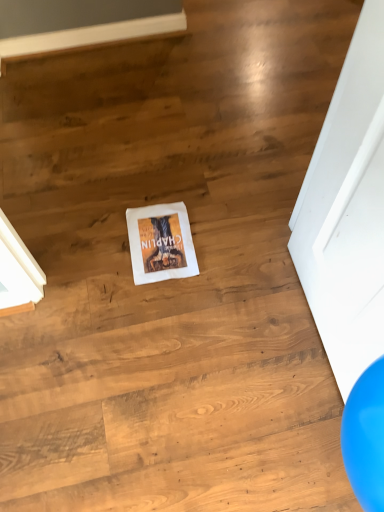
The image size is (384, 512). I want to click on vacant space underneath white cloth at center (from a real-world perspective), so click(x=159, y=241).